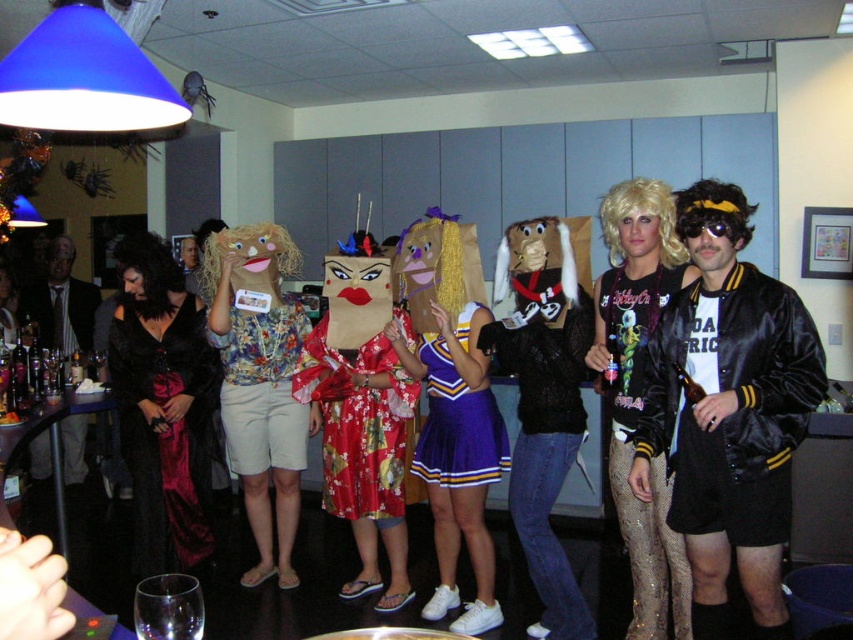
You are a photographer positioned at the back of the room. You want to take a photo that includes both the matte black jacket at center and the matte black suit at left. Which object should you adjust your camera angle to focus on first to ensure both are in frame?

The matte black jacket at center is closer to the viewer than the matte black suit at left, so you should focus on the matte black jacket at center first to ensure both are in frame.

You are a photographer at the party and need to capture a photo of both the satin black bomber jacket at center right and the matte black jacket at center. However, your camera has a minimum focus distance requirement of 50 centimeters. Can you fit both jackets into the frame without moving the camera?

The satin black bomber jacket at center right and the matte black jacket at center are 57.57 centimeters apart from each other. Since this distance exceeds the camera minimum focus distance of 50 centimeters, you can fit both jackets into the frame without moving the camera.